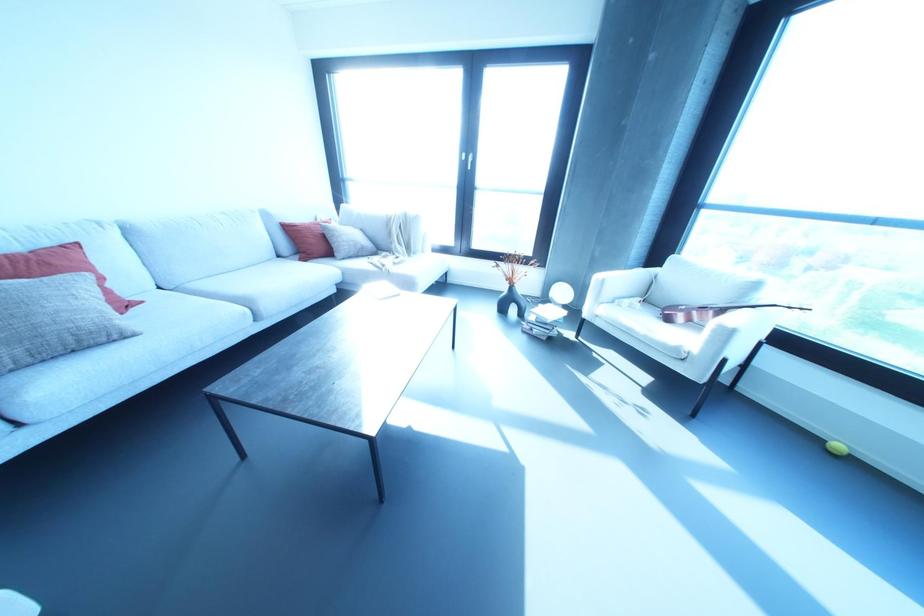
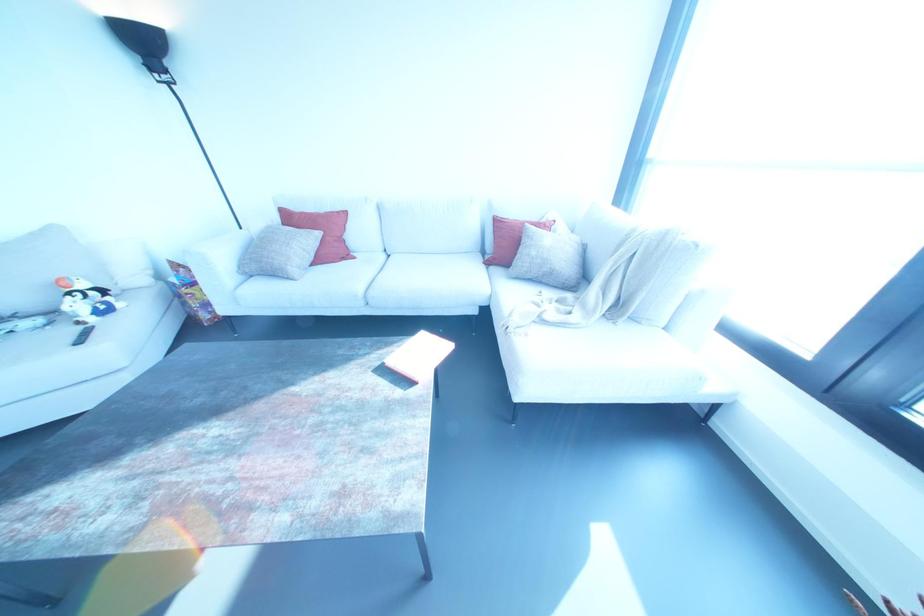
Where in the second image is the point corresponding to (125,334) from the first image?

(287, 277)